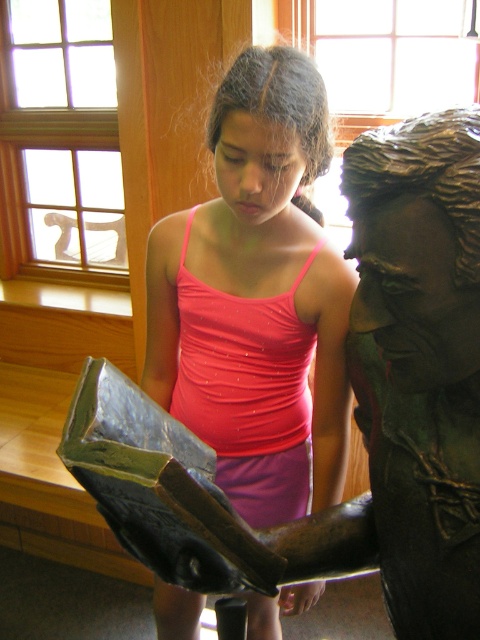
You are a fashion designer observing the image. You notice the bronze statue at center and the pink matte tank top at center. Which object is smaller in size?

The bronze statue at center is smaller in size compared to the pink matte tank top at center according to the description.

You are a photographer trying to capture both the bronze statue at center and the pink matte tank top at center in a single frame. Given that your camera has a fixed focal length, which object should you adjust your focus on first to ensure both are in the frame?

Since the bronze statue at center is wider than the pink matte tank top at center, you should adjust your focus on the bronze statue at center first to accommodate its larger width in the frame.